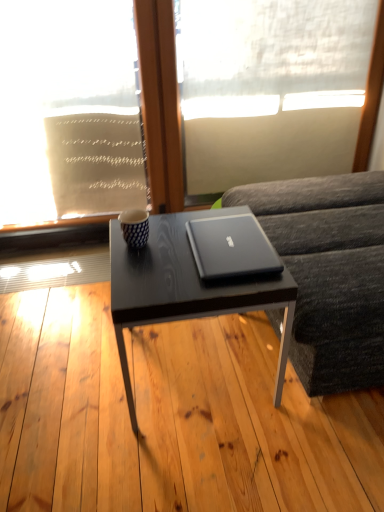
I want to click on free spot above satin black laptop at center (from a real-world perspective), so click(x=232, y=237).